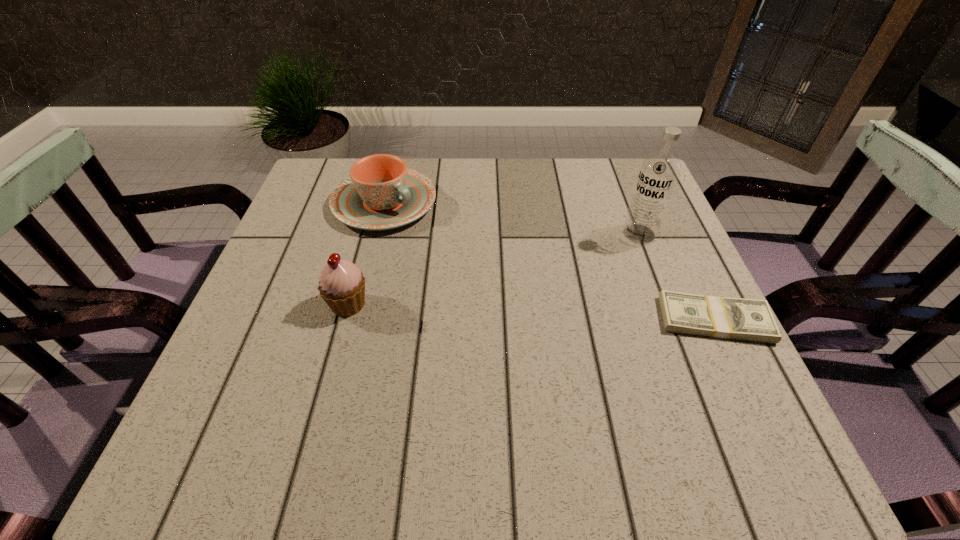
Locate an element on the screen. This screenshot has width=960, height=540. cupcake is located at coordinates (342, 286).

Locate an element on the screen. the shortest object is located at coordinates (719, 317).

I want to click on chinaware, so click(381, 193).

This screenshot has height=540, width=960. What are the coordinates of `vodka` in the screenshot? It's located at pyautogui.click(x=659, y=172).

Where is `free space located on the back of the third shortest object`? This screenshot has width=960, height=540. free space located on the back of the third shortest object is located at coordinates (361, 258).

The height and width of the screenshot is (540, 960). Identify the location of vacant area located on the left of the dollar. (459, 320).

Locate an element on the screen. free space located 0.110m on the handle side of the third tallest object is located at coordinates (452, 246).

Where is `vacant space located 0.260m on the handle side of the third tallest object`? The image size is (960, 540). vacant space located 0.260m on the handle side of the third tallest object is located at coordinates (502, 278).

The image size is (960, 540). I want to click on vacant region located 0.060m on the handle side of the third tallest object, so click(437, 236).

The width and height of the screenshot is (960, 540). Find the location of `free space located 0.290m on the front label of the vodka`. free space located 0.290m on the front label of the vodka is located at coordinates (534, 298).